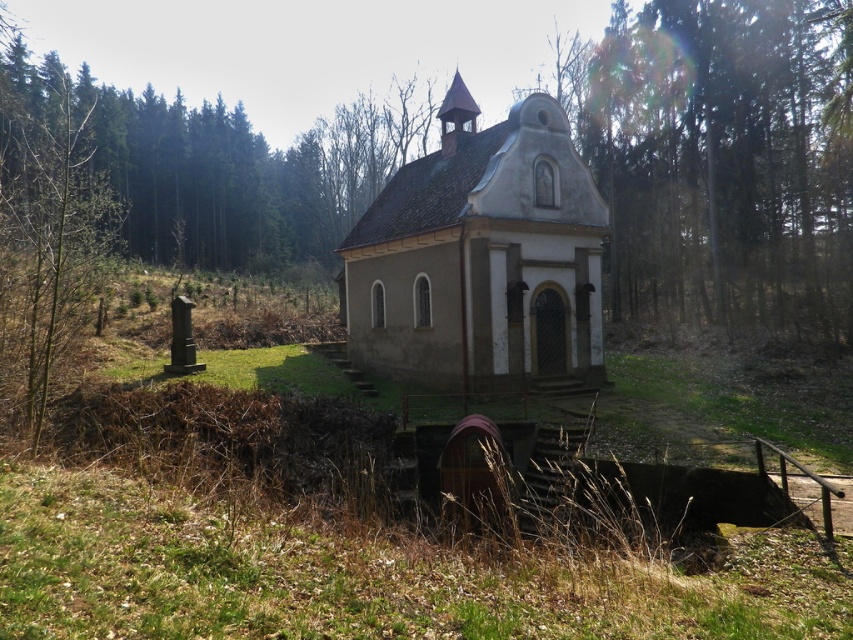
You are standing in front of the chapel and want to walk from point A to point B. Point A is at coordinate point [380,273] and point B is at coordinate point [0,195]. Which direction should you move to reach point B from point A?

To reach point B from point A, you should move downward because point A is higher than point B in the image.

You are a hiker who wants to take a photo of the beige stone church at center and the brown wood tree at left. Which object should you focus on first to ensure both are in the frame?

You should focus on the beige stone church at center first because it is closer to you than the brown wood tree at left, so adjusting the camera to include both would require starting with the closer object.